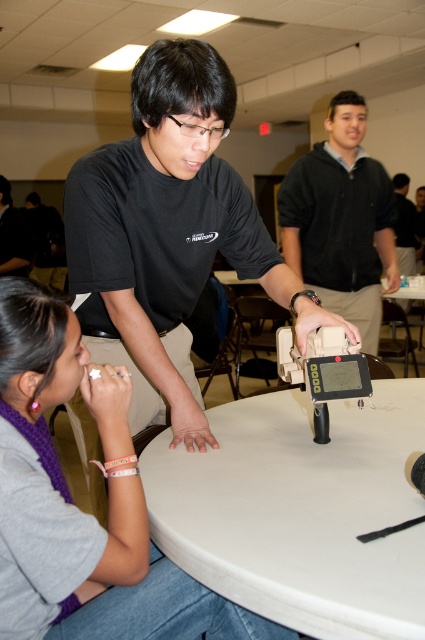
In the scene shown: Does gray fabric shirt at lower left have a lesser height compared to black matte shirt at center?

Yes.

Can you confirm if gray fabric shirt at lower left is bigger than black matte shirt at center?

No.

Which is in front, point (82, 520) or point (16, 227)?

Positioned in front is point (82, 520).

Image resolution: width=425 pixels, height=640 pixels. In order to click on gray fabric shirt at lower left in this screenshot , I will do `click(79, 509)`.

How distant is white plastic table at center from black matte shirt at upper center?

white plastic table at center is 5.40 meters away from black matte shirt at upper center.

Who is more forward, (258, 428) or (402, 216)?

Point (258, 428) is more forward.

Is point (394, 573) farther from viewer compared to point (401, 237)?

No.

Find the location of a particular element. The height and width of the screenshot is (640, 425). white plastic table at center is located at coordinates (300, 509).

Is white plastic table at center to the left of gray fabric shirt at lower left from the viewer's perspective?

In fact, white plastic table at center is to the right of gray fabric shirt at lower left.

Who is taller, white plastic table at center or gray fabric shirt at lower left?

With more height is gray fabric shirt at lower left.

Measure the distance between point (396, 472) and camera.

The distance of point (396, 472) from camera is 3.43 feet.

Where is `white plastic table at center`? white plastic table at center is located at coordinates (300, 509).